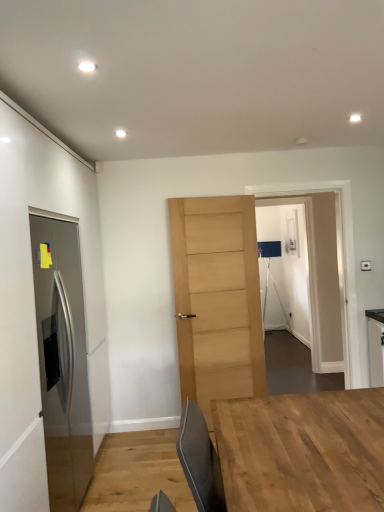
Question: From a real-world perspective, is natural wood table at center over transparent glass door at center, acting as the 1th glass door starting from the front?

Choices:
 (A) no
 (B) yes

Answer: (A)

Question: Is the position of natural wood table at center less distant than that of transparent glass door at center, marked as the second glass door in a back-to-front arrangement?

Choices:
 (A) yes
 (B) no

Answer: (A)

Question: Can you confirm if natural wood table at center is positioned to the right of transparent glass door at center, marked as the second glass door in a back-to-front arrangement?

Choices:
 (A) no
 (B) yes

Answer: (A)

Question: Considering the relative sizes of natural wood table at center and transparent glass door at center, marked as the second glass door in a back-to-front arrangement, in the image provided, is natural wood table at center thinner than transparent glass door at center, marked as the second glass door in a back-to-front arrangement,?

Choices:
 (A) yes
 (B) no

Answer: (B)

Question: Is natural wood table at center smaller than transparent glass door at center, acting as the 1th glass door starting from the front?

Choices:
 (A) yes
 (B) no

Answer: (A)

Question: Considering the relative positions of stainless steel door at left, positioned as the 2th door in right-to-left order, and transparent glass door at center, marked as the second glass door in a back-to-front arrangement, in the image provided, is stainless steel door at left, positioned as the 2th door in right-to-left order, to the left or to the right of transparent glass door at center, marked as the second glass door in a back-to-front arrangement,?

Choices:
 (A) left
 (B) right

Answer: (A)

Question: From a real-world perspective, is stainless steel door at left, arranged as the second door when viewed from the back, positioned above or below transparent glass door at center, marked as the second glass door in a back-to-front arrangement?

Choices:
 (A) below
 (B) above

Answer: (A)

Question: From the image's perspective, is stainless steel door at left, marked as the first door in a left-to-right arrangement, located above or below transparent glass door at center, marked as the second glass door in a back-to-front arrangement?

Choices:
 (A) below
 (B) above

Answer: (A)

Question: Which is correct: stainless steel door at left, which ranks as the first door in front-to-back order, is inside transparent glass door at center, marked as the second glass door in a back-to-front arrangement, or outside of it?

Choices:
 (A) inside
 (B) outside

Answer: (B)

Question: From a real-world perspective, is natural wood table at center above or below transparent glass door at center, marked as the second glass door in a back-to-front arrangement?

Choices:
 (A) above
 (B) below

Answer: (B)

Question: Would you say natural wood table at center is to the left or to the right of transparent glass door at center, acting as the 1th glass door starting from the front, in the picture?

Choices:
 (A) left
 (B) right

Answer: (A)

Question: Is natural wood table at center wider or thinner than transparent glass door at center, marked as the second glass door in a back-to-front arrangement?

Choices:
 (A) wide
 (B) thin

Answer: (A)

Question: Considering the positions of point (347, 502) and point (329, 204), is point (347, 502) closer or farther from the camera than point (329, 204)?

Choices:
 (A) closer
 (B) farther

Answer: (A)

Question: Is light wood door at center, which is counted as the 2th door, starting from the left, bigger or smaller than natural wood table at center?

Choices:
 (A) small
 (B) big

Answer: (B)

Question: Is point (248, 256) closer or farther from the camera than point (253, 487)?

Choices:
 (A) closer
 (B) farther

Answer: (B)